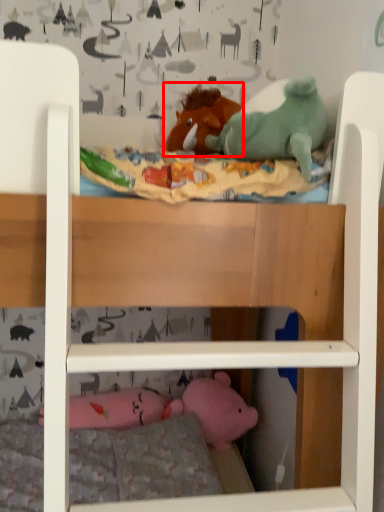
Question: From the image's perspective, what is the correct spatial positioning of toy (annotated by the red box) in reference to pillow?

Choices:
 (A) above
 (B) below

Answer: (A)